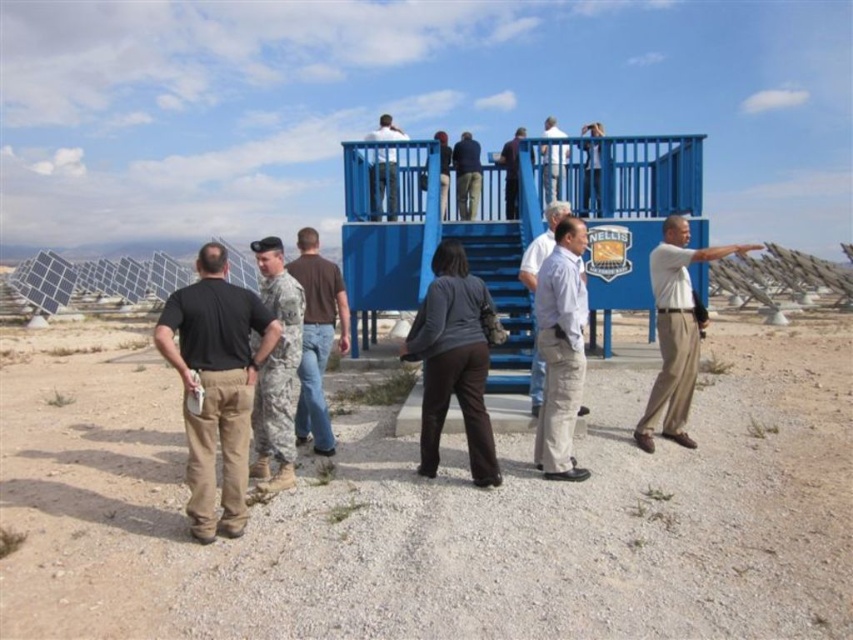
You are a tour guide at the Nellis Solar Power Plant. You notice two visitors wearing a camouflage uniform at center and a brown cotton shirt at center. Which visitor is standing closer to the front of the group?

The camouflage uniform at center is located below the brown cotton shirt at center, meaning it is positioned closer to the front of the group.

Based on the photo, what object corresponds to the coordinates point (383,182) in the image?

The point (383,182) corresponds to the matte white shirt at upper center.